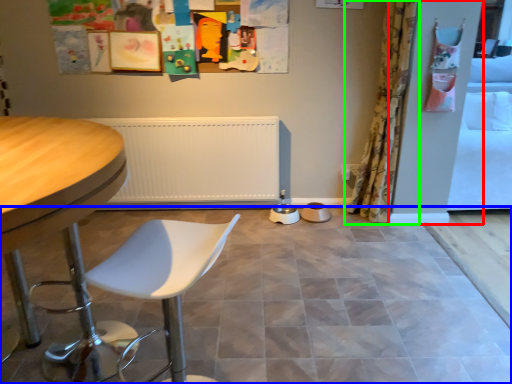
Question: Which object is the closest to the screen door (highlighted by a red box)? Choose among these: ceramic tile (highlighted by a blue box) or curtain (highlighted by a green box).

Choices:
 (A) ceramic tile
 (B) curtain

Answer: (B)